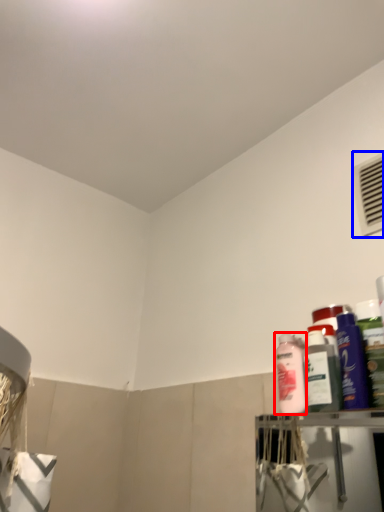
Question: Which point is further to the camera, cleaning product (highlighted by a red box) or air conditioning (highlighted by a blue box)?

Choices:
 (A) cleaning product
 (B) air conditioning

Answer: (B)